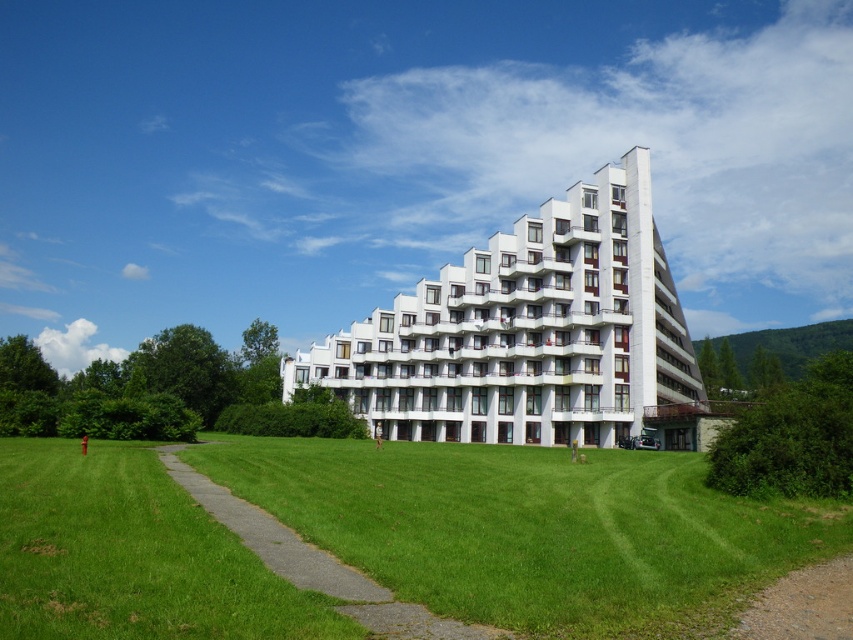
Question: Can you confirm if white smooth building at center is thinner than green grass at center?

Choices:
 (A) no
 (B) yes

Answer: (A)

Question: Where is white smooth building at center located in relation to green grass at center in the image?

Choices:
 (A) below
 (B) above

Answer: (B)

Question: Considering the relative positions of white smooth building at center and green grass at center in the image provided, where is white smooth building at center located with respect to green grass at center?

Choices:
 (A) left
 (B) right

Answer: (B)

Question: Among these objects, which one is farthest from the camera?

Choices:
 (A) white smooth building at center
 (B) green grass at center

Answer: (A)

Question: Which point is farther to the camera?

Choices:
 (A) (627, 317)
 (B) (383, 604)

Answer: (A)